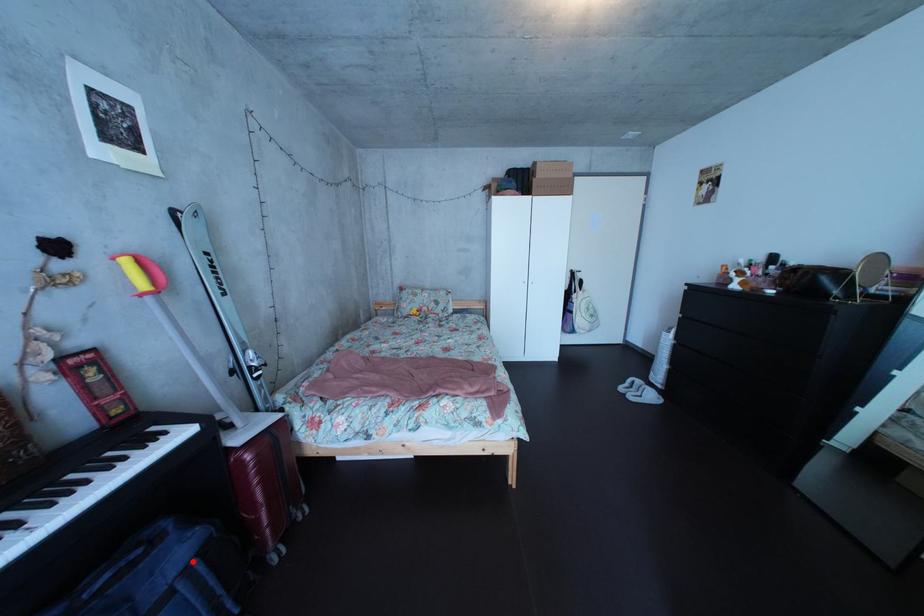
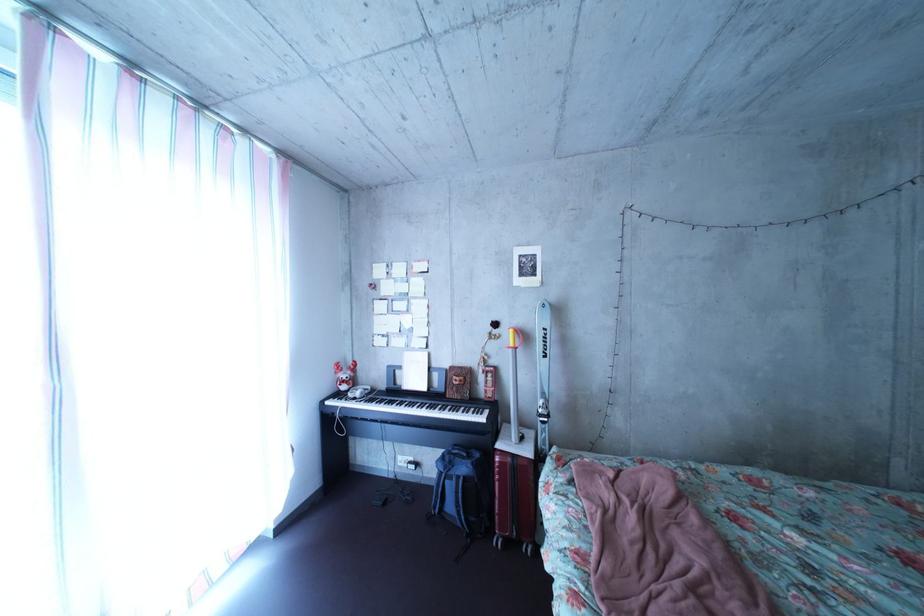
The point at the highlighted location is marked in the first image. Where is the corresponding point in the second image?

(479, 477)